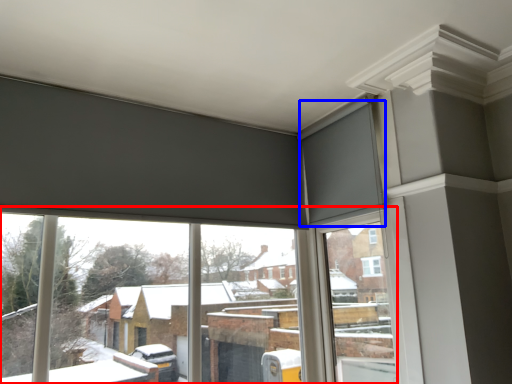
Question: Which object appears farthest to the camera in this image, window (highlighted by a red box) or curtain (highlighted by a blue box)?

Choices:
 (A) window
 (B) curtain

Answer: (B)